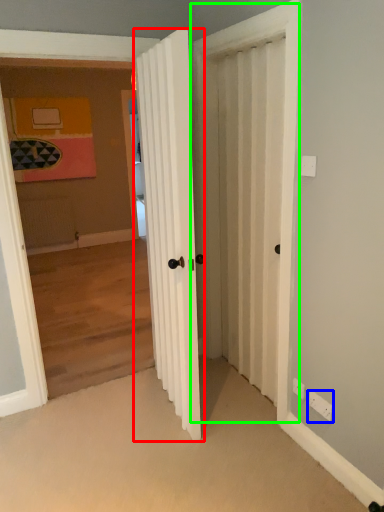
Question: Considering the real-world distances, which object is farthest from door (highlighted by a red box)? electric outlet (highlighted by a blue box) or screen door (highlighted by a green box)?

Choices:
 (A) electric outlet
 (B) screen door

Answer: (A)